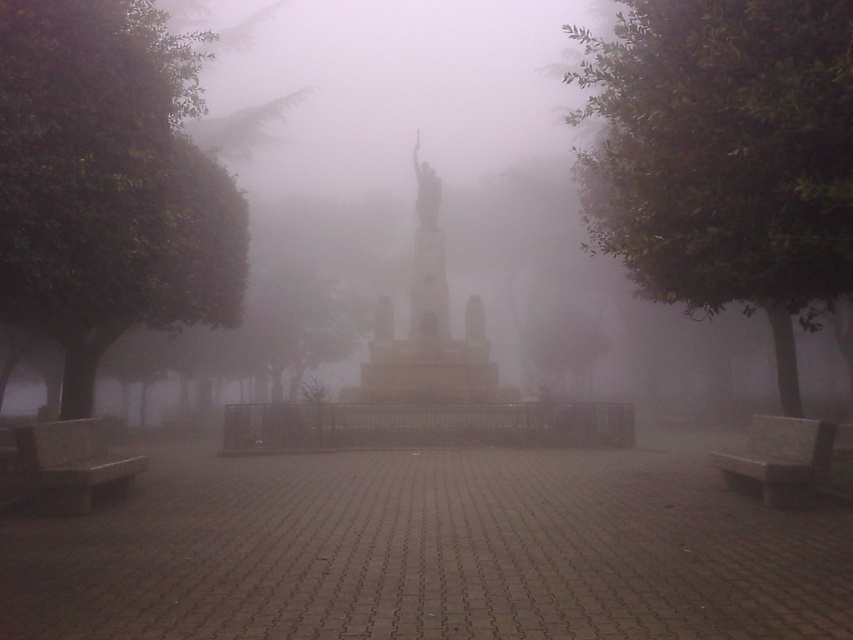
You are standing at the center of the monument area and want to sit down. Where is the smooth gray bench at lower left located relative to your current position?

The smooth gray bench at lower left is located at point [71,464] relative to your current position at the center of the monument area.

You are a visitor in the park and want to sit on the gray stone bench at lower right. As you walk from the monument towards the bench, will the green leafy tree at right block your path?

The green leafy tree at right is in front of the gray stone bench at lower right, so it will block your path when walking from the monument towards the bench.